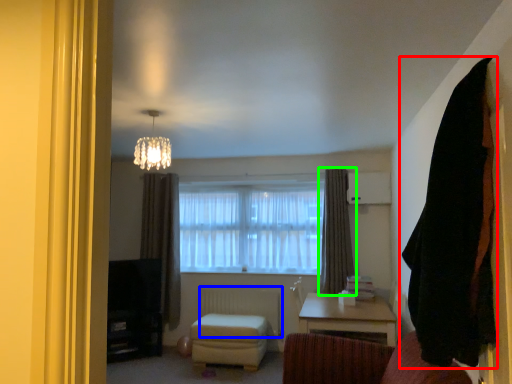
Question: Considering the real-world distances, which object is farthest from curtain (highlighted by a red box)? radiator (highlighted by a blue box) or curtain (highlighted by a green box)?

Choices:
 (A) radiator
 (B) curtain

Answer: (A)